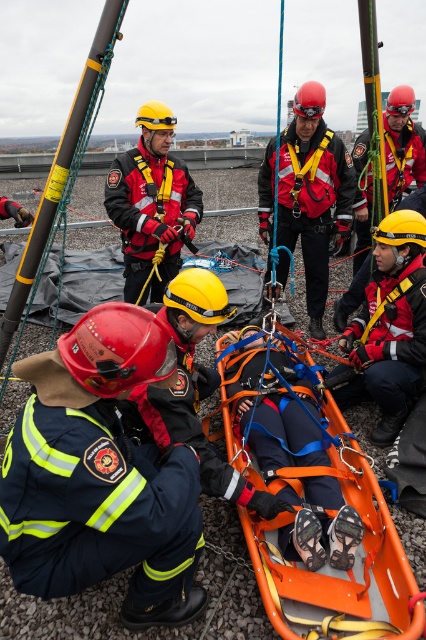
Can you confirm if red fabric helmet at lower left is shorter than red hard hat at center?

Yes.

Who is taller, red fabric helmet at lower left or red hard hat at center?

Standing taller between the two is red hard hat at center.

This screenshot has width=426, height=640. What do you see at coordinates (100, 474) in the screenshot?
I see `red fabric helmet at lower left` at bounding box center [100, 474].

At what (x,y) coordinates should I click in order to perform the action: click on red fabric helmet at lower left. Please return your answer as a coordinate pair (x, y). The width and height of the screenshot is (426, 640). Looking at the image, I should click on (100, 474).

Does orange plastic stretcher at center lie behind orange fabric stretcher at center?

No, it is not.

Measure the distance from orange plastic stretcher at center to orange fabric stretcher at center.

orange plastic stretcher at center is 79.11 centimeters away from orange fabric stretcher at center.

Image resolution: width=426 pixels, height=640 pixels. I want to click on orange plastic stretcher at center, so click(325, 564).

Does red hard hat at center have a greater width compared to matte black helmet at center?

Correct, the width of red hard hat at center exceeds that of matte black helmet at center.

Between red hard hat at center and matte black helmet at center, which one has less height?

matte black helmet at center

Who is more forward, (x=284, y=204) or (x=144, y=237)?

Point (x=144, y=237) is in front.

Locate an element on the screen. The height and width of the screenshot is (640, 426). red hard hat at center is located at coordinates (313, 193).